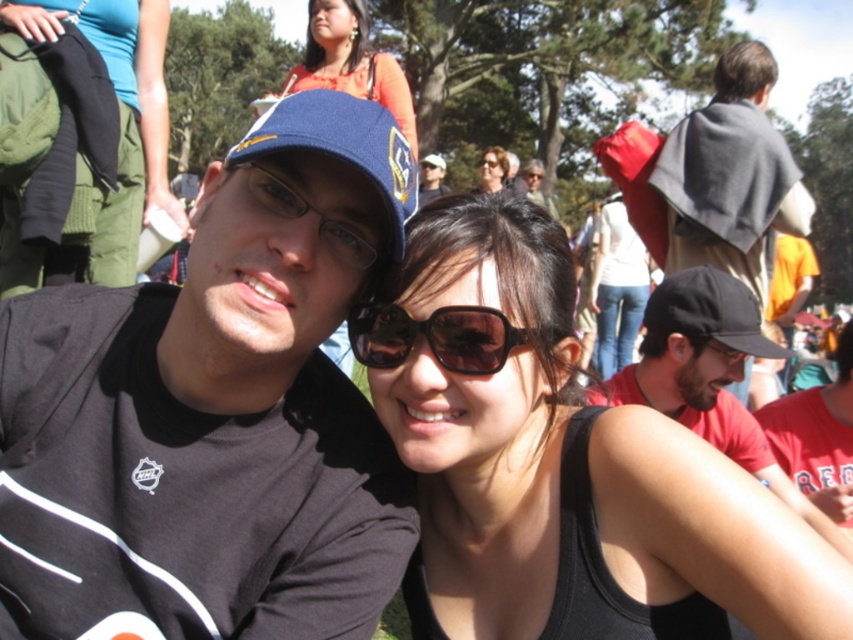
You are a photographer at the event and want to capture a photo of the black fabric shirt at center and the green fabric pants at center. Which one should you focus on first if you want to ensure the taller object is in focus?

The green fabric pants at center is taller than the black fabric shirt at center, so you should focus on the green fabric pants at center first to ensure the taller object is in focus.

Consider the image. You are organizing a clothing donation drive and need to categorize items by size. You have two items to sort out. The first is a black fabric shirt at center and the second is a black fabric baseball cap at right. Which item is larger in size?

The black fabric shirt at center is bigger than the black fabric baseball cap at right, so the shirt is the larger item.

You are a photographer trying to capture a clear shot of both the matte black cap at upper center and the brown matte sunglasses at center. Which object should you focus on first if you want to ensure both are in focus, considering their positions?

Since the matte black cap at upper center is taller than the brown matte sunglasses at center, you should focus on the matte black cap at upper center first to ensure both are in focus.